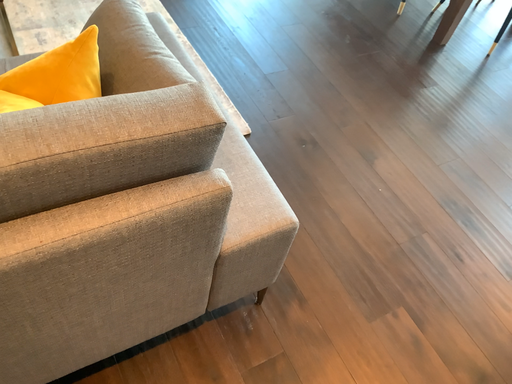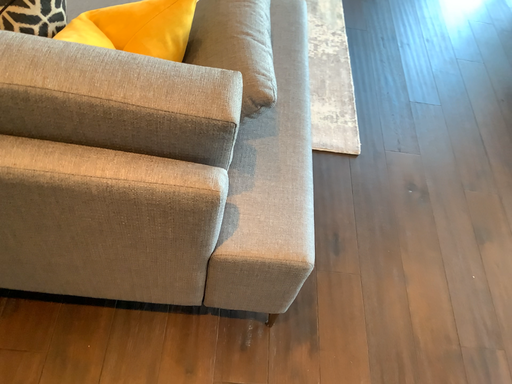
Question: Which way did the camera rotate in the video?

Choices:
 (A) rotated left
 (B) rotated right

Answer: (A)